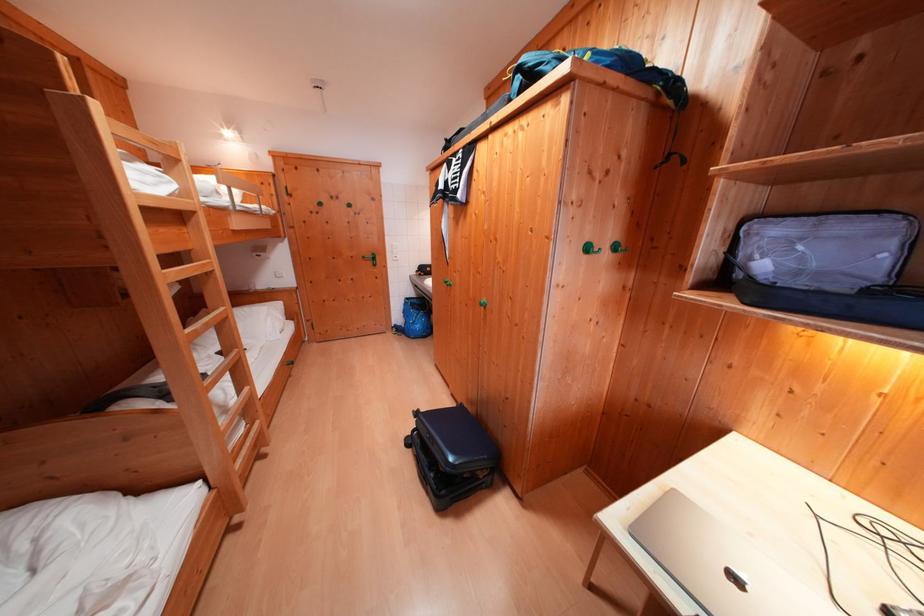
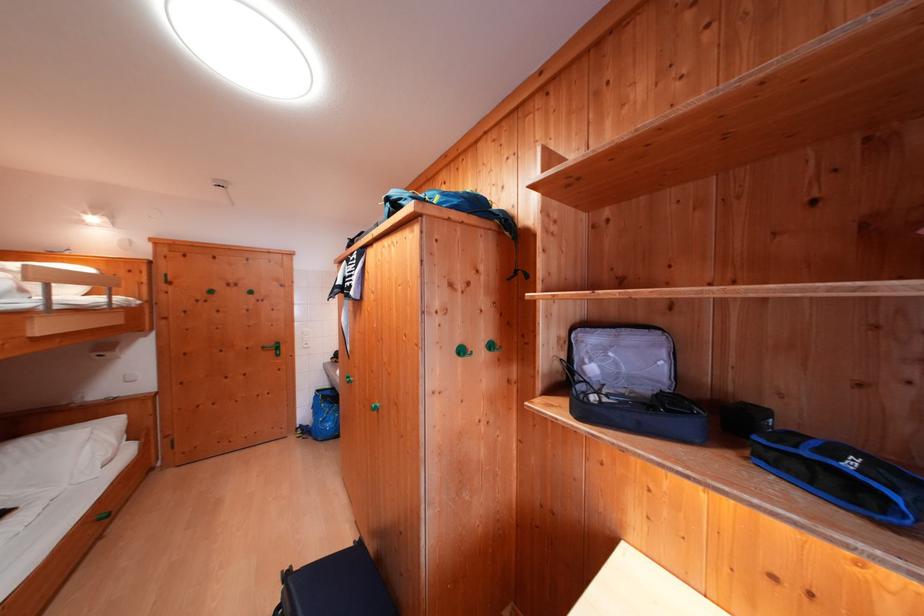
Where in the second image is the point corresponding to point (424, 418) from the first image?

(296, 578)